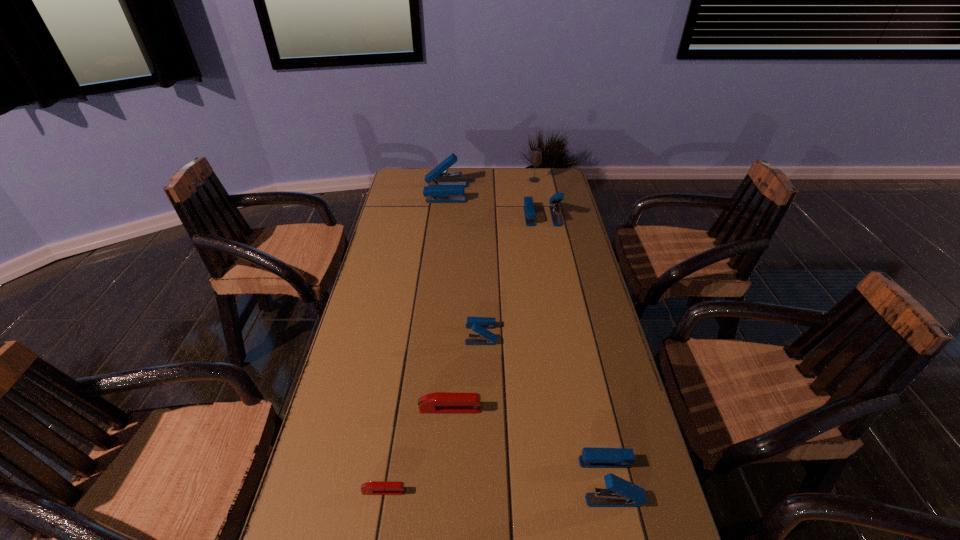
Locate an element on the screen. glass drink container present at the far edge is located at coordinates (536, 154).

Identify the location of stapler present at the far edge. The width and height of the screenshot is (960, 540). (437, 191).

The image size is (960, 540). Find the location of `glass drink container at the right edge`. glass drink container at the right edge is located at coordinates (536, 154).

The height and width of the screenshot is (540, 960). I want to click on object present at the far left corner, so click(437, 191).

Identify the location of object located in the far right corner section of the desktop. (536, 154).

I want to click on blank space at the left edge of the desktop, so click(406, 213).

In the image, there is a desktop. At what (x,y) coordinates should I click in order to perform the action: click on vacant space at the right edge. Please return your answer as a coordinate pair (x, y). This screenshot has width=960, height=540. Looking at the image, I should click on (578, 341).

You are a GUI agent. You are given a task and a screenshot of the screen. Output one action in this format:
    pyautogui.click(x=<x>, y=<y>)
    Task: Click on the vacant area at the far right corner
    
    Given the screenshot: What is the action you would take?
    pyautogui.click(x=546, y=175)

Where is `vacant area between the leftmost blue stapler and the third biggest blue stapler`? This screenshot has width=960, height=540. vacant area between the leftmost blue stapler and the third biggest blue stapler is located at coordinates (528, 337).

The width and height of the screenshot is (960, 540). Identify the location of empty space between the third tallest stapler and the glass drink container. (572, 330).